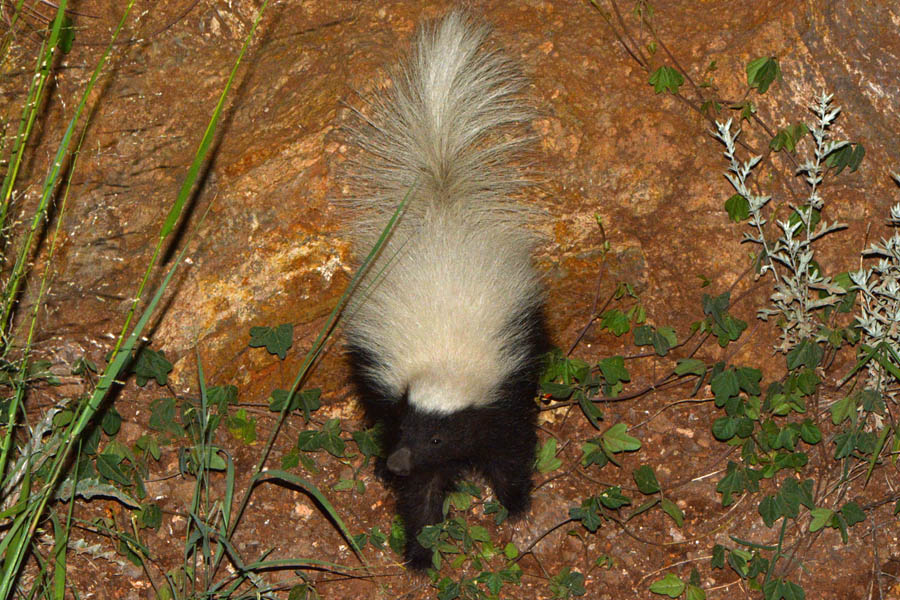
Image resolution: width=900 pixels, height=600 pixels. I want to click on white fur, so click(418, 291).